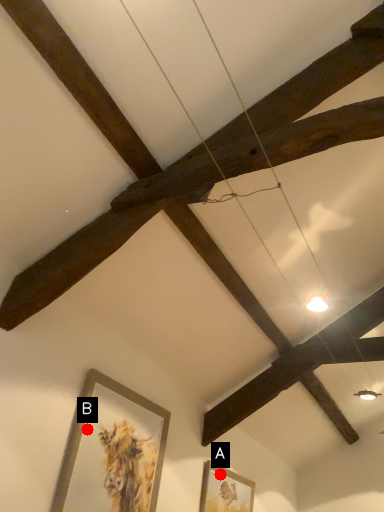
Question: Two points are circled on the image, labeled by A and B beside each circle. Which of the following is the closest to the observer?

Choices:
 (A) A is closer
 (B) B is closer

Answer: (B)